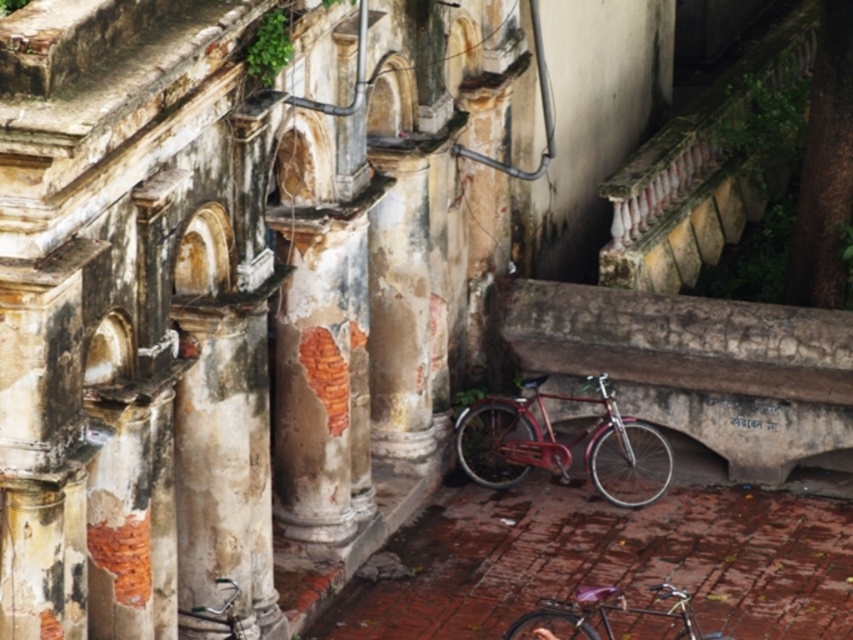
Question: Which point is closer to the camera?

Choices:
 (A) shiny purple bicycle at lower center
 (B) shiny metallic bicycle at lower center

Answer: (A)

Question: Is shiny metallic bicycle at lower center thinner than shiny purple bicycle at lower center?

Choices:
 (A) yes
 (B) no

Answer: (B)

Question: Is shiny metallic bicycle at lower center behind shiny purple bicycle at lower center?

Choices:
 (A) yes
 (B) no

Answer: (A)

Question: Among these points, which one is nearest to the camera?

Choices:
 (A) (608, 472)
 (B) (589, 595)

Answer: (B)

Question: Does shiny metallic bicycle at lower center have a greater width compared to shiny purple bicycle at lower center?

Choices:
 (A) yes
 (B) no

Answer: (A)